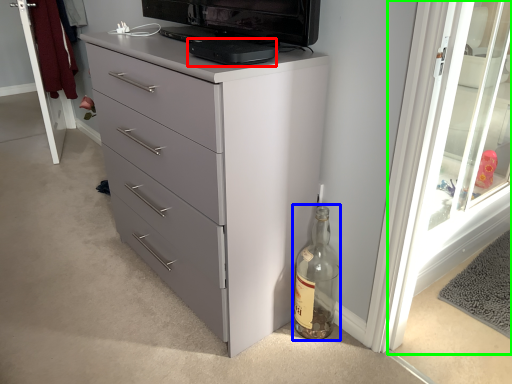
Question: Which object is positioned farthest from appliance (highlighted by a red box)? Select from glass bottle (highlighted by a blue box) and screen door (highlighted by a green box).

Choices:
 (A) glass bottle
 (B) screen door

Answer: (B)